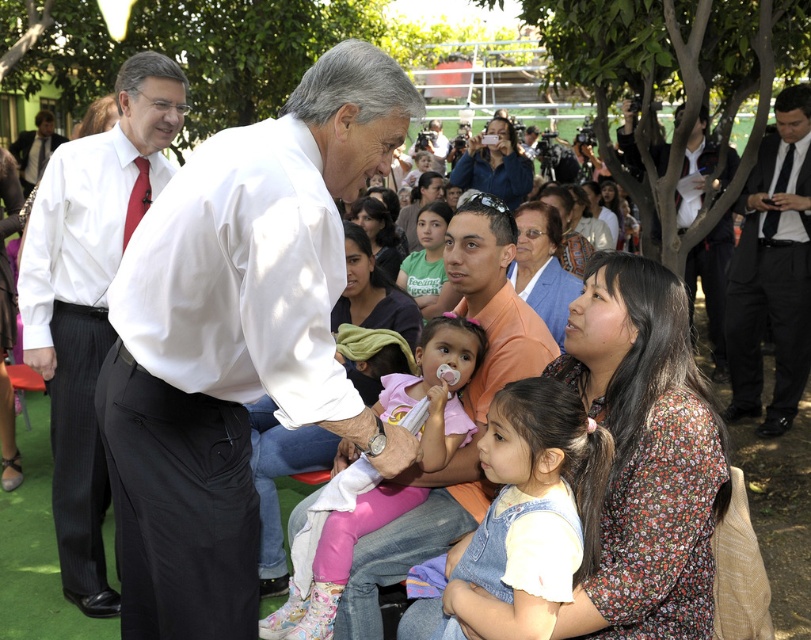
Looking at this image, you are a photographer trying to capture a candid shot of the central figure and the child. You notice the white shirt at left and the red silk tie at center in your viewfinder. Which object should you focus on to ensure the subject is clearly visible in the photo?

The white shirt at left is bigger than the red silk tie at center, so focusing on the white shirt at left would ensure the subject is clearly visible in the photo because it is larger and more prominent.

Based on the scene description, which object is bigger between the white shirt at center and the black suit at right?

The white shirt at center is larger in size compared to the black suit at right.

Based on the scene description, where is the white shirt at left located in terms of its 2D coordinates?

The white shirt at left is located at the 2D coordinates point (88, 301).